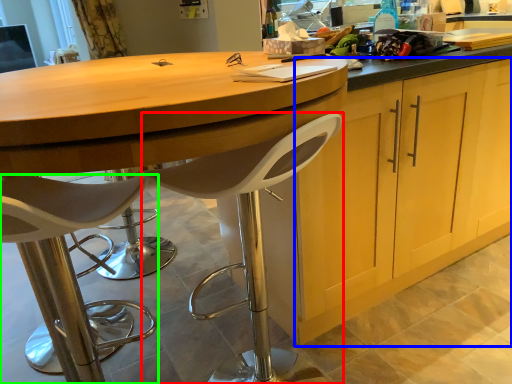
Question: Which is nearer to the chair (highlighted by a red box)? cabinetry (highlighted by a blue box) or chair (highlighted by a green box).

Choices:
 (A) cabinetry
 (B) chair

Answer: (B)